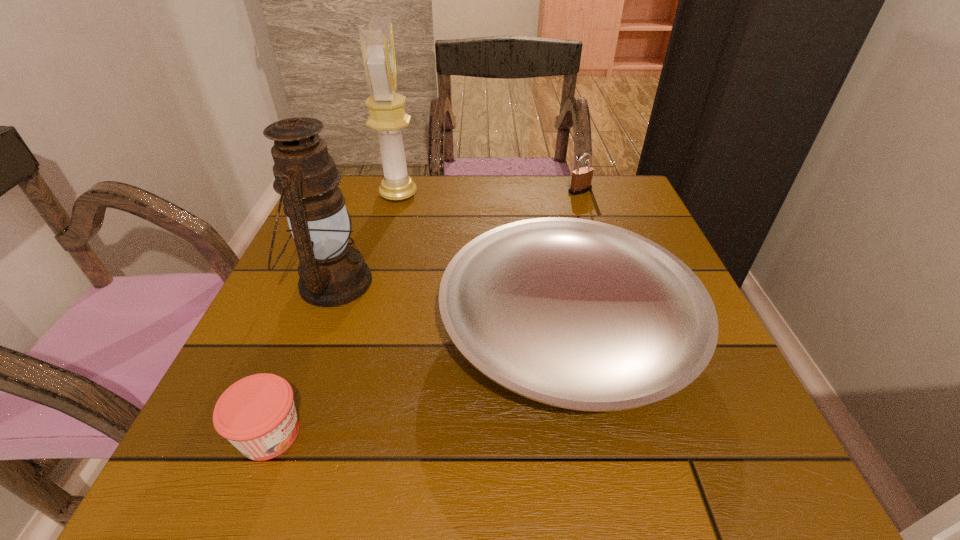
What are the coordinates of `vacant area in the image that satisfies the following two spatial constraints: 1. on the front-facing side of the bedpan; 2. on the right side of the award` in the screenshot? It's located at (x=363, y=328).

Find the location of `free space that satisfies the following two spatial constraints: 1. on the front-facing side of the award; 2. on the right side of the bedpan`. free space that satisfies the following two spatial constraints: 1. on the front-facing side of the award; 2. on the right side of the bedpan is located at coordinates (363, 328).

Locate an element on the screen. The image size is (960, 540). free space that satisfies the following two spatial constraints: 1. on the back side of the padlock; 2. on the right side of the oil lamp is located at coordinates (367, 191).

Find the location of `free space that satisfies the following two spatial constraints: 1. on the front side of the bedpan; 2. on the front label of the jam`. free space that satisfies the following two spatial constraints: 1. on the front side of the bedpan; 2. on the front label of the jam is located at coordinates (588, 434).

Image resolution: width=960 pixels, height=540 pixels. What are the coordinates of `free region that satisfies the following two spatial constraints: 1. on the front side of the oil lamp; 2. on the right side of the bedpan` in the screenshot? It's located at (315, 328).